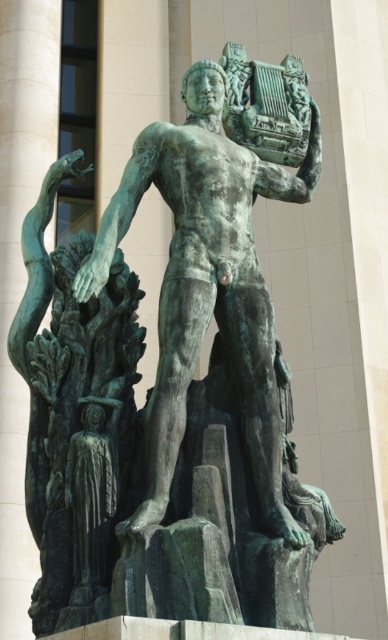
You are standing 40 meters away from the sculpture. Can you see the point at coordinate point (178, 368) on the sculpture?

The distance of point (178, 368) from the camera is 39.04 meters, so yes, you can see the point at coordinate point (178, 368) on the sculpture because it is closer than your position.

You are an art conservator needing to move the green patina statue at center and the green patina tree at left to a storage room. The storage room has a 3.5 meter wide entrance. If you move them side by side, will they fit through the entrance together?

The distance between the green patina statue at center and the green patina tree at left is 3.09 meters. Since the entrance is 3.5 meters wide, moving them side by side would allow them to fit through the entrance as 3.09 meters is less than 3.5 meters.

You are standing in front of a large sculpture garden. You see the green patina statue at center. If you want to take a photo of it with your phone, which has a maximum focus range of 35 meters, will you be able to capture it clearly?

The green patina statue at center is 36.56 meters away from you. Since your phone can only focus up to 35 meters, you won not be able to capture it clearly.